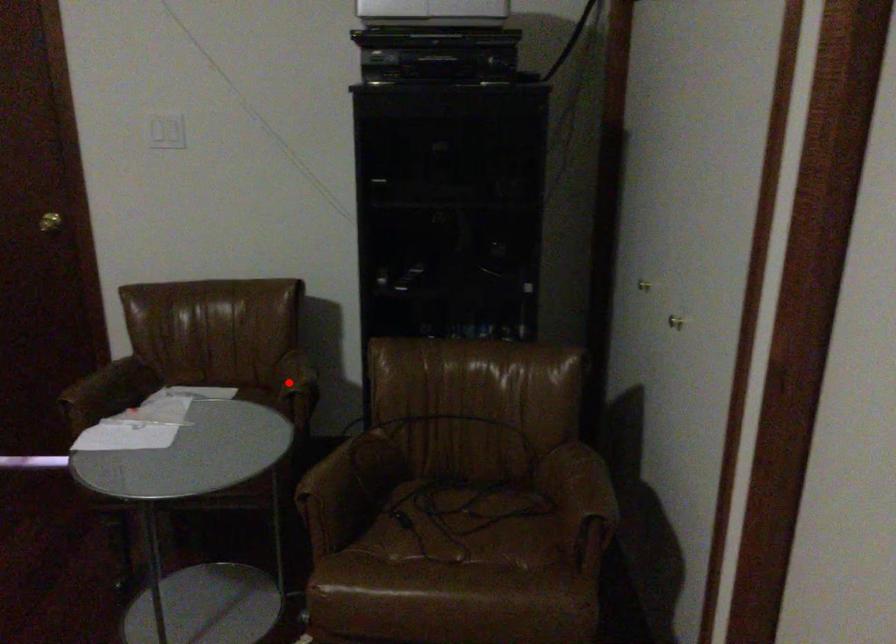
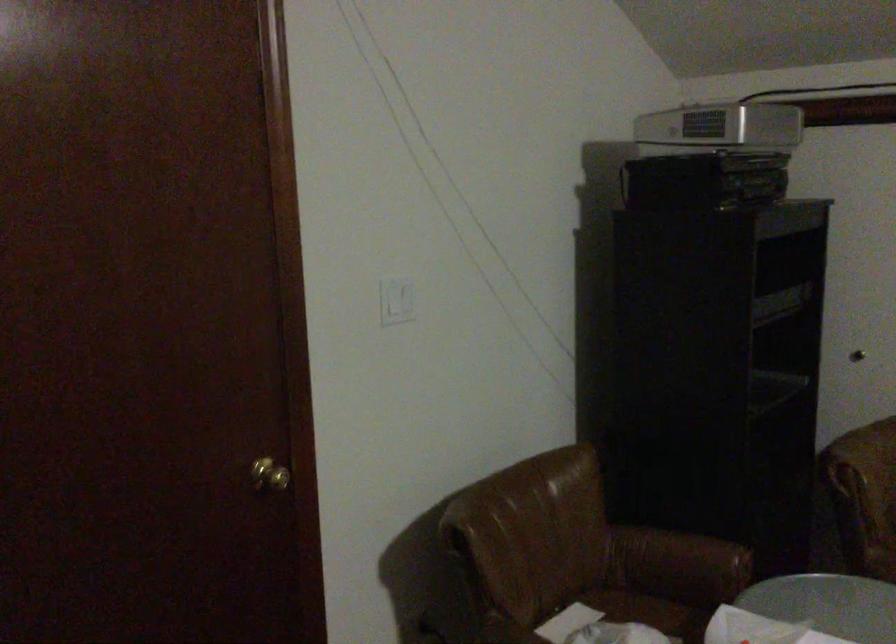
The point at the highlighted location is marked in the first image. Where is the corresponding point in the second image?

(679, 559)